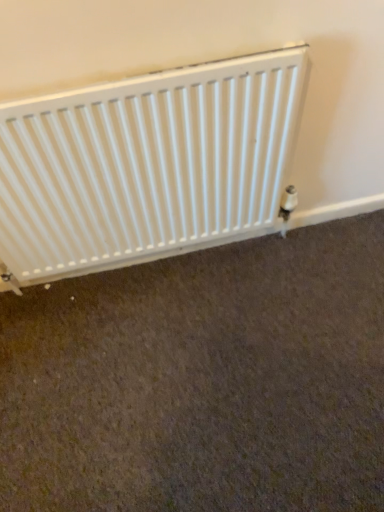
Where is `vacant space to the right of white matte radiator at center`? vacant space to the right of white matte radiator at center is located at coordinates (284, 291).